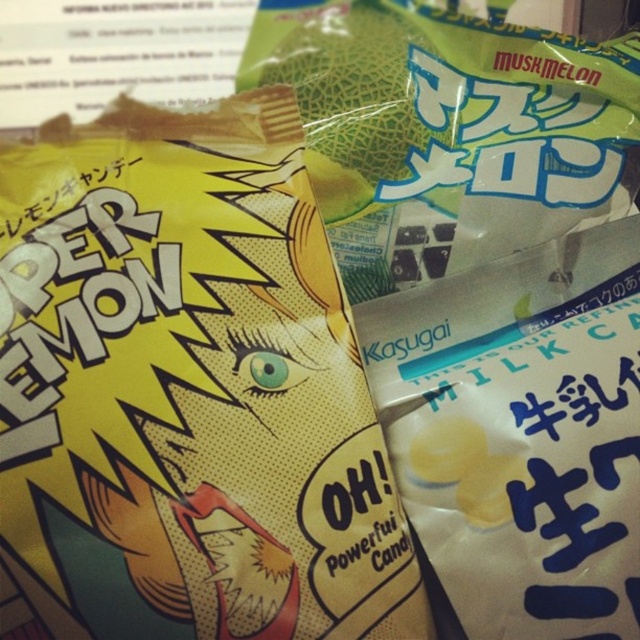
Which is in front, point (109, 342) or point (260, 44)?

Positioned in front is point (109, 342).

Is point (152, 388) less distant than point (355, 65)?

That is True.

What do you see at coordinates (186, 392) in the screenshot? Image resolution: width=640 pixels, height=640 pixels. I see `yellow glossy candy at center` at bounding box center [186, 392].

Find the location of a particular element. The height and width of the screenshot is (640, 640). yellow glossy candy at center is located at coordinates (186, 392).